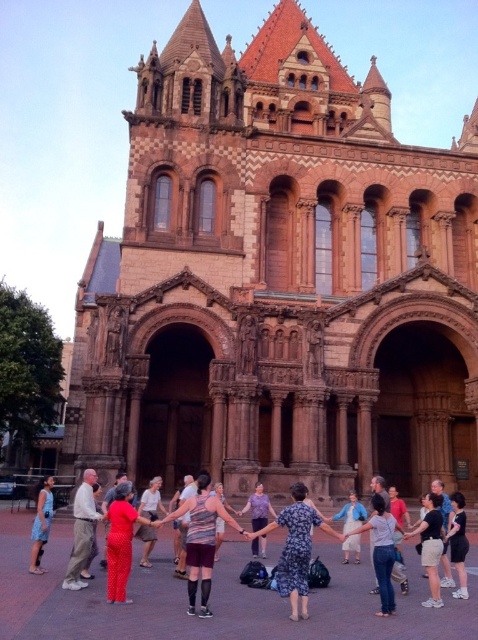
Is point (377, 547) more distant than point (438, 515)?

No, it is not.

Who is more forward, (389, 518) or (428, 540)?

Point (389, 518) is more forward.

Where is `matte gray shirt at center`? matte gray shirt at center is located at coordinates (381, 552).

Is point (293, 497) farther from camera compared to point (83, 484)?

No.

Where is `floral dress at center`? The width and height of the screenshot is (478, 640). floral dress at center is located at coordinates (295, 548).

Between matte red dress at center and black fabric dress at lower right, which one is positioned lower?

black fabric dress at lower right is lower down.

What do you see at coordinates (120, 541) in the screenshot? I see `matte red dress at center` at bounding box center [120, 541].

Where is `matte red dress at center`? This screenshot has width=478, height=640. matte red dress at center is located at coordinates (120, 541).

Locate an element on the screen. This screenshot has height=640, width=478. matte red dress at center is located at coordinates (120, 541).